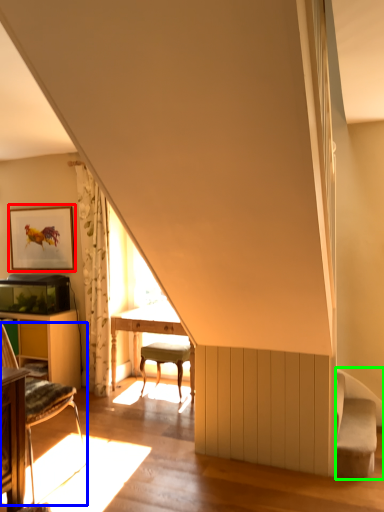
Question: Which object is positioned closest to picture frame (highlighted by a red box)? Select from chair (highlighted by a blue box) and swivel chair (highlighted by a green box).

Choices:
 (A) chair
 (B) swivel chair

Answer: (A)